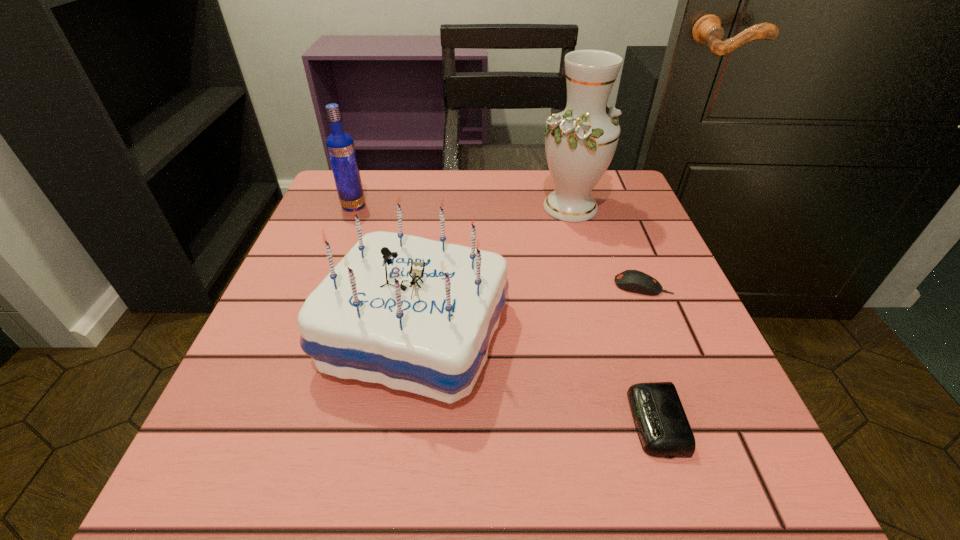
The width and height of the screenshot is (960, 540). What are the coordinates of `object positioned at the far left corner` in the screenshot? It's located at (340, 146).

The image size is (960, 540). Find the location of `object located in the far right corner section of the desktop`. object located in the far right corner section of the desktop is located at coordinates (580, 142).

The height and width of the screenshot is (540, 960). Find the location of `object that is positioned at the near right corner`. object that is positioned at the near right corner is located at coordinates (663, 428).

Locate an element on the screen. The image size is (960, 540). free space at the far edge of the desktop is located at coordinates pyautogui.click(x=418, y=191).

Locate an element on the screen. The image size is (960, 540). free spot at the near edge of the desktop is located at coordinates (426, 463).

Where is `free space at the left edge`? The width and height of the screenshot is (960, 540). free space at the left edge is located at coordinates (250, 383).

This screenshot has height=540, width=960. I want to click on free space at the right edge, so click(636, 377).

This screenshot has height=540, width=960. I want to click on free region at the far left corner of the desktop, so click(362, 224).

Where is `vacant region at the near left corner of the desktop`? The width and height of the screenshot is (960, 540). vacant region at the near left corner of the desktop is located at coordinates (208, 480).

This screenshot has width=960, height=540. I want to click on vacant space at the near right corner of the desktop, so click(724, 460).